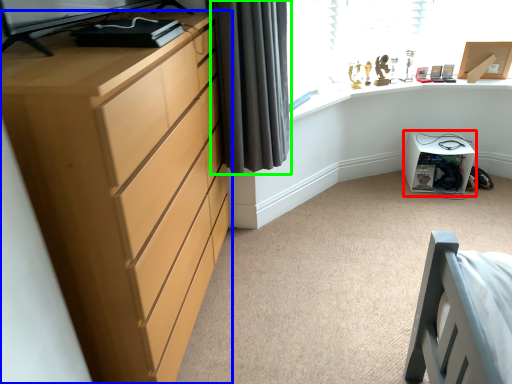
Question: Which object is positioned closest to cabinetry (highlighted by a red box)? Select from chest of drawers (highlighted by a blue box) and curtain (highlighted by a green box).

Choices:
 (A) chest of drawers
 (B) curtain

Answer: (B)